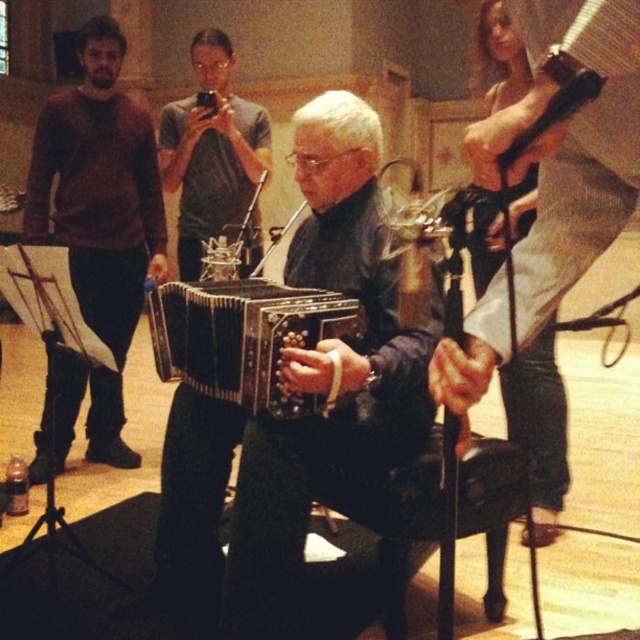
Question: Does matte black accordion at center have a smaller size compared to matte gray shirt at center?

Choices:
 (A) no
 (B) yes

Answer: (B)

Question: Which point is farther from the camera taking this photo?

Choices:
 (A) (77, 381)
 (B) (177, 349)

Answer: (A)

Question: Which of the following is the farthest from the observer?

Choices:
 (A) black matte accordion at center
 (B) wooden accordion at center

Answer: (B)

Question: Among these points, which one is farthest from the camera?

Choices:
 (A) (172, 132)
 (B) (88, 276)
 (C) (465, 438)

Answer: (A)

Question: Is brown sweater at left positioned in front of matte black accordion at center?

Choices:
 (A) no
 (B) yes

Answer: (A)

Question: Is wooden accordion at center further to camera compared to matte gray shirt at center?

Choices:
 (A) yes
 (B) no

Answer: (B)